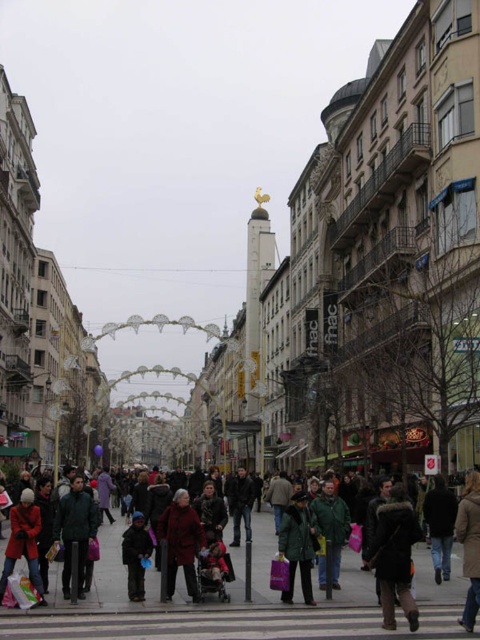
Question: Does dark brown fur coat at center have a smaller size compared to green matte coat at center?

Choices:
 (A) no
 (B) yes

Answer: (A)

Question: Among these objects, which one is farthest from the camera?

Choices:
 (A) dark brown leather jacket at lower right
 (B) matte red coat at lower left
 (C) dark green coat at center

Answer: (B)

Question: Can you confirm if green matte coat at center is positioned above dark brown leather jacket at lower right?

Choices:
 (A) yes
 (B) no

Answer: (B)

Question: In this image, where is dark red coat at center located relative to matte red coat at lower left?

Choices:
 (A) above
 (B) below

Answer: (B)

Question: Estimate the real-world distances between objects in this image. Which object is farther from the dark brown leather jacket at lower right?

Choices:
 (A) matte red coat at lower left
 (B) dark brown fur coat at center
 (C) dark blue jacket at lower center

Answer: (A)

Question: Considering the real-world distances, which object is farthest from the dark green coat at center?

Choices:
 (A) dark brown leather jacket at lower right
 (B) dark red coat at center
 (C) dark blue jacket at lower center
 (D) dark brown fur coat at center

Answer: (A)